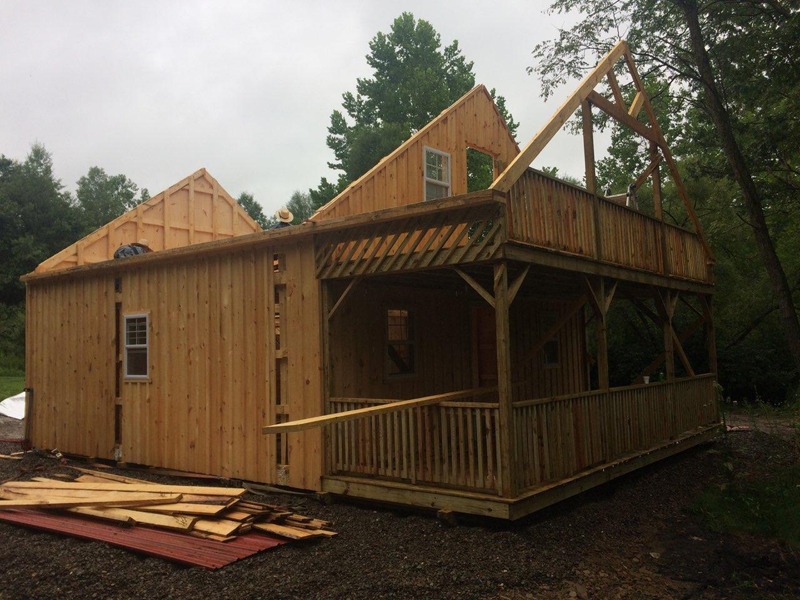
You are a GUI agent. You are given a task and a screenshot of the screen. Output one action in this format:
    pyautogui.click(x=<x>, y=<y>)
    Task: Click on the structure corners
    
    Given the screenshot: What is the action you would take?
    (x=30, y=273), (x=488, y=193), (x=701, y=238), (x=710, y=372), (x=505, y=403)